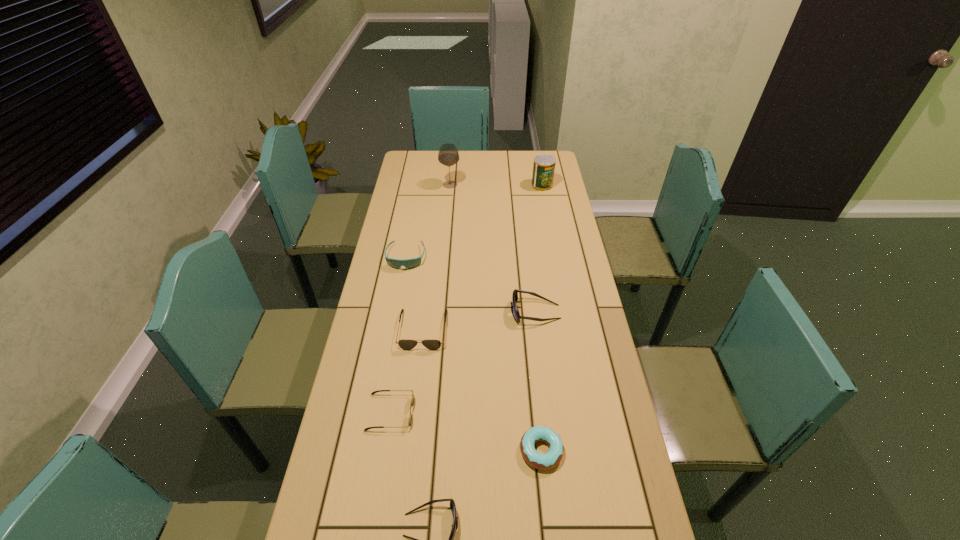
Locate an element on the screen. The width and height of the screenshot is (960, 540). vacant space in between the shortest sunglasses and the blue doughnut is located at coordinates (466, 431).

At what (x,y) coordinates should I click in order to perform the action: click on unoccupied position between the farther black sunglasses and the tallest object. Please return your answer as a coordinate pair (x, y). Image resolution: width=960 pixels, height=540 pixels. Looking at the image, I should click on (437, 257).

The height and width of the screenshot is (540, 960). Identify the location of blank region between the second tallest object and the tallest object. (496, 185).

Point out which object is positioned as the seventh nearest to the can. Please provide its 2D coordinates. Your answer should be formatted as a tuple, i.e. [(x, y)], where the tuple contains the x and y coordinates of a point satisfying the conditions above.

[(452, 504)]

Where is `object identified as the second closest to the cyan sunglasses`? The image size is (960, 540). object identified as the second closest to the cyan sunglasses is located at coordinates (516, 315).

Locate an element on the screen. The image size is (960, 540). sunglasses that is the third closest to the sixth nearest object is located at coordinates (412, 400).

This screenshot has width=960, height=540. What are the coordinates of `sunglasses object that ranks as the second closest to the sixth nearest object` in the screenshot? It's located at (516, 315).

Identify the location of free space that satisfies the following two spatial constraints: 1. on the front-facing side of the shortest sunglasses; 2. on the left side of the blue doughnut. (384, 450).

I want to click on vacant space that satisfies the following two spatial constraints: 1. on the front-facing side of the doughnut; 2. on the left side of the farther black sunglasses, so tap(408, 450).

Image resolution: width=960 pixels, height=540 pixels. I want to click on free region that satisfies the following two spatial constraints: 1. on the front-facing side of the third tallest object; 2. on the front-facing side of the bigger black sunglasses, so click(x=538, y=329).